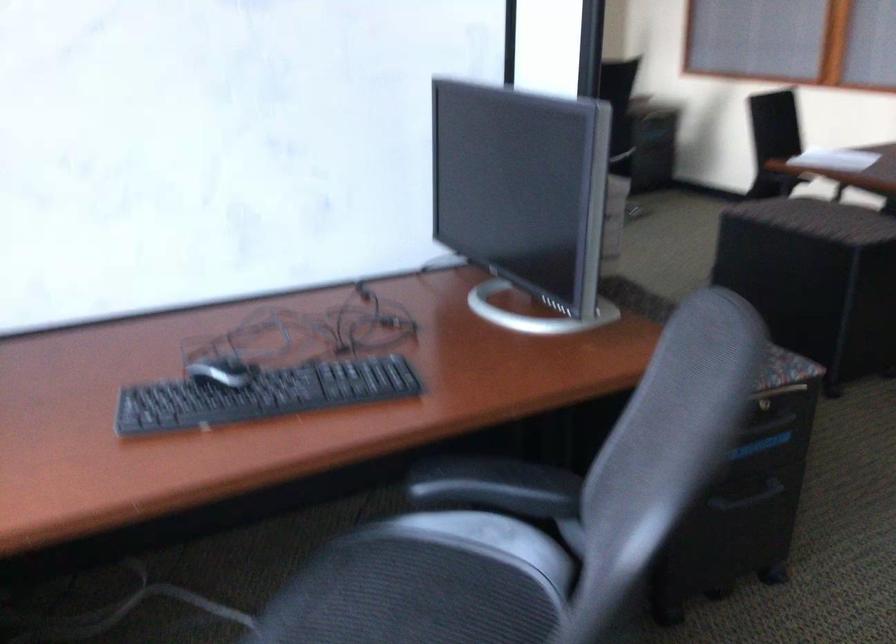
Which object does [220,371] point to?

It corresponds to the computer mouse in the image.